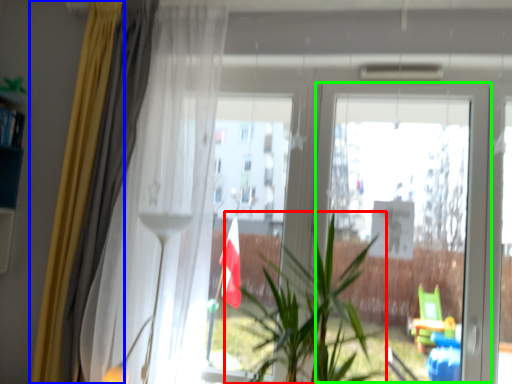
Question: Based on their relative distances, which object is nearer to houseplant (highlighted by a red box)? Choose from curtain (highlighted by a blue box) and screen door (highlighted by a green box).

Choices:
 (A) curtain
 (B) screen door

Answer: (B)